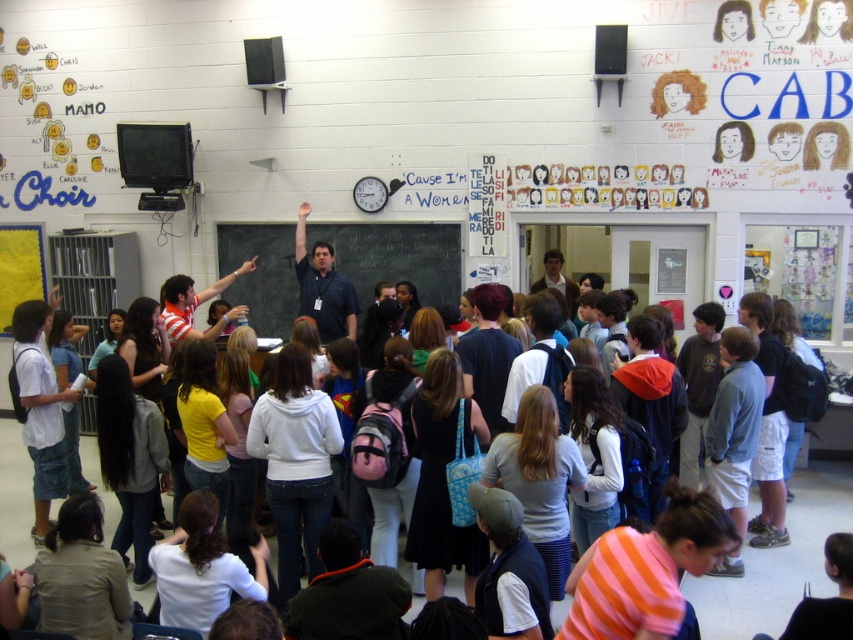
Question: Can you confirm if white cotton hoodie at center is thinner than blackboard at center?

Choices:
 (A) yes
 (B) no

Answer: (B)

Question: Can you confirm if white cotton hoodie at center is bigger than blackboard at center?

Choices:
 (A) no
 (B) yes

Answer: (B)

Question: Which object is positioned closest to the matte blue shirt at center?

Choices:
 (A) white cotton hoodie at center
 (B) blackboard at center

Answer: (B)

Question: In this image, where is white cotton hoodie at center located relative to matte blue shirt at center?

Choices:
 (A) right
 (B) left

Answer: (A)

Question: Which point is closer to the camera?

Choices:
 (A) blackboard at center
 (B) white cotton hoodie at center

Answer: (B)

Question: Among these points, which one is nearest to the camera?

Choices:
 (A) (339, 328)
 (B) (434, 252)

Answer: (A)